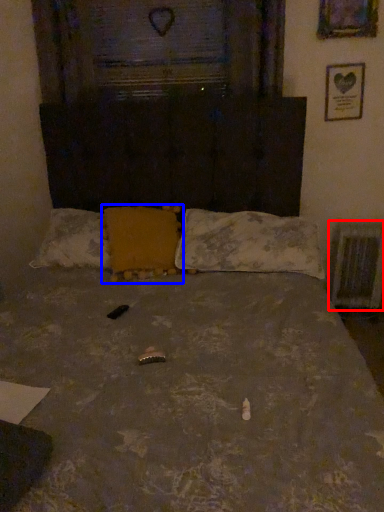
Question: Among these objects, which one is farthest to the camera, radiator (highlighted by a red box) or pillow (highlighted by a blue box)?

Choices:
 (A) radiator
 (B) pillow

Answer: (A)